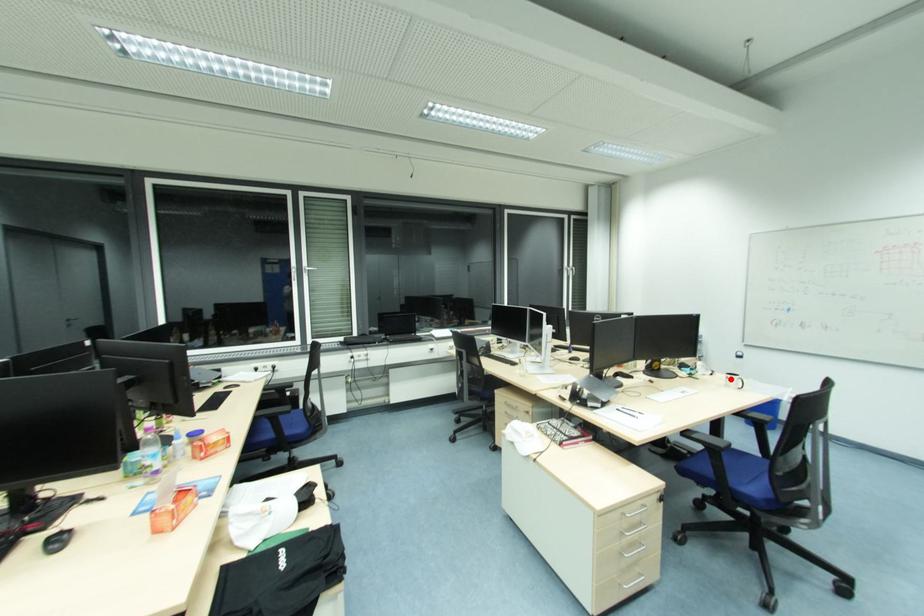
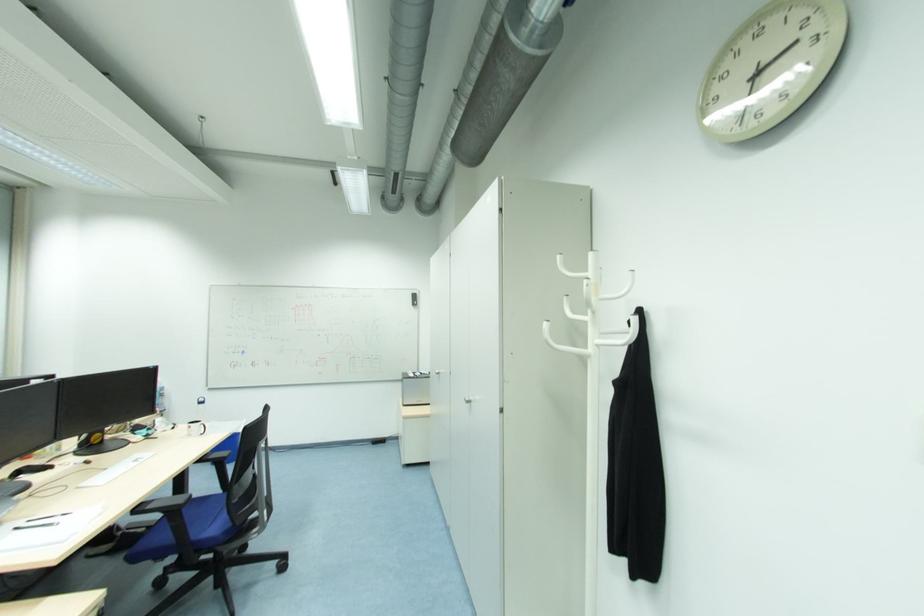
Where in the second image is the point corresponding to the highlighted location from the first image?

(192, 429)